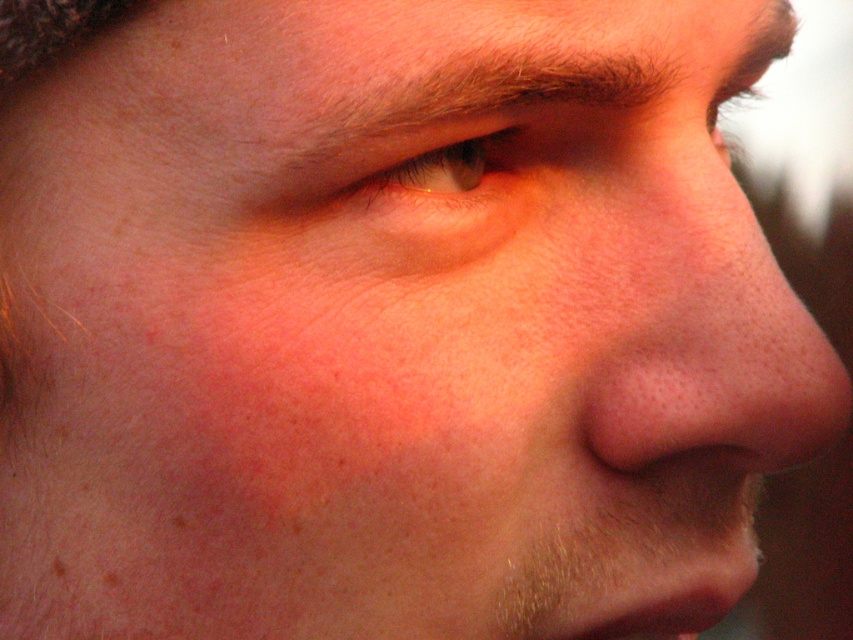
You are a photographer using a camera with a focal length of 50mm. You want to capture a close portrait of the pink smooth skin at center while maintaining sharp focus. Given that the minimum focusing distance for your camera at this focal length is 35 centimeters, will you be able to take the photo without moving closer?

The distance between the pink smooth skin at center and the camera is 37.28 centimeters, which is beyond the camera lens minimum focusing distance of 35 centimeters. Therefore, you can take the photo without moving closer.

Based on the scene description, which object is positioned higher on the face between the pink smooth skin at center and the green matte eye at upper center?

The green matte eye at upper center is positioned higher on the face than the pink smooth skin at center.

You are a photographer adjusting the lighting for a portrait. You notice the pink smooth skin at center and the green matte eye at upper center in the frame. Which object is located to the right of the other?

The pink smooth skin at center is positioned on the right side of green matte eye at upper center.